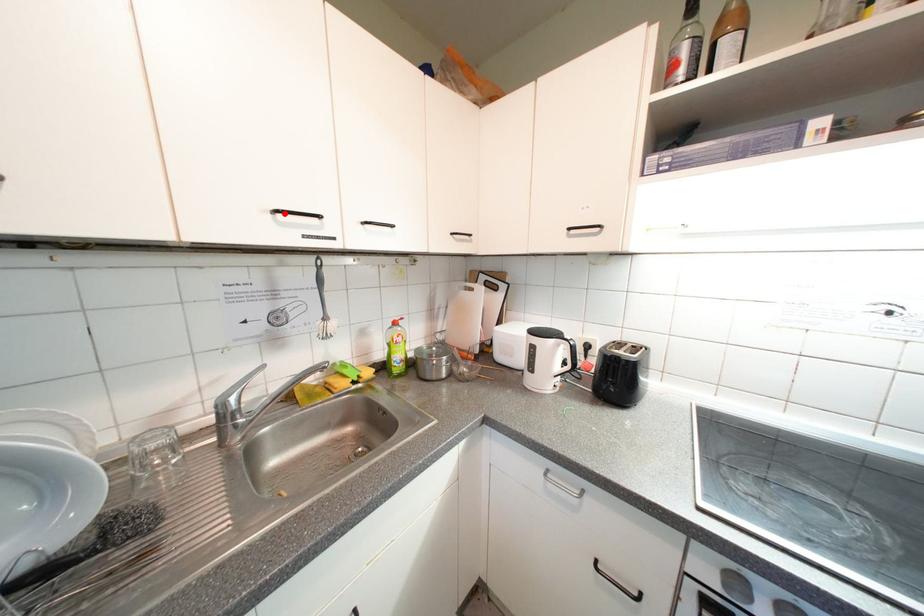
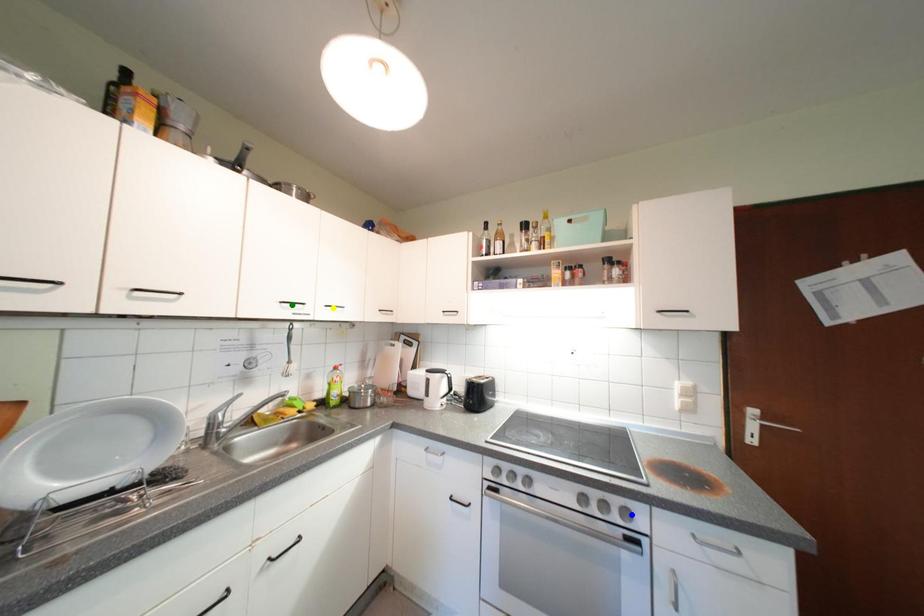
Question: I am providing you with two images of the same scene from different viewpoints. A red point is marked on the first image. You are given multiple points on the second image. In image 2, which mark is for the same physical point as the one in image 1?

Choices:
 (A) green point
 (B) blue point
 (C) yellow point

Answer: (A)